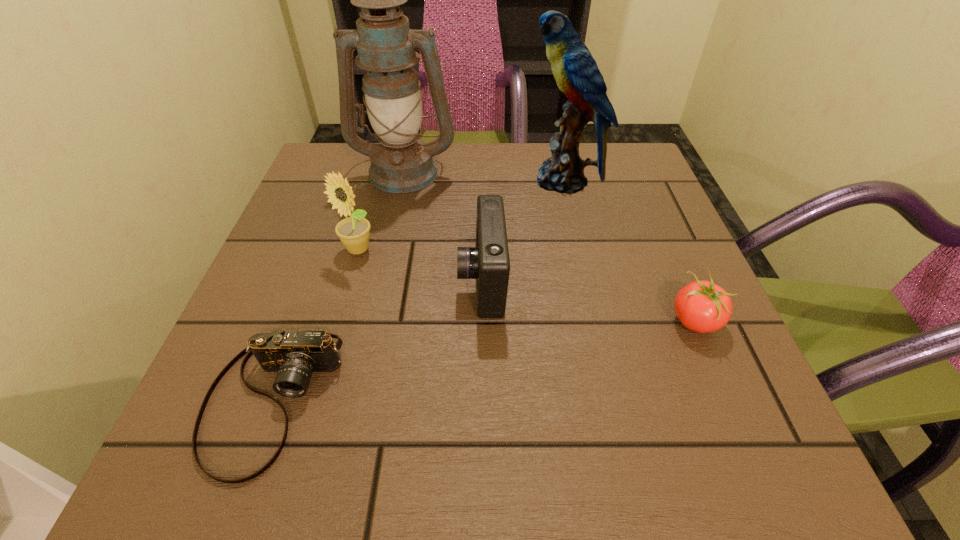
This screenshot has height=540, width=960. What are the coordinates of `oil lamp` in the screenshot? It's located at (401, 163).

Where is `parrot`? The width and height of the screenshot is (960, 540). parrot is located at coordinates (576, 72).

Where is `sunflower`? sunflower is located at coordinates coord(354,233).

This screenshot has height=540, width=960. In order to click on the taller camera in this screenshot , I will do `click(488, 262)`.

Find the location of a particular element. This screenshot has width=960, height=540. the third object from right to left is located at coordinates (488, 262).

Find the location of `tomato`. tomato is located at coordinates (701, 306).

The width and height of the screenshot is (960, 540). In order to click on the rightmost object in this screenshot , I will do `click(701, 306)`.

Image resolution: width=960 pixels, height=540 pixels. Find the location of `the shortest object`. the shortest object is located at coordinates [x=294, y=355].

What are the coordinates of `the shorter camera` in the screenshot? It's located at (294, 355).

This screenshot has height=540, width=960. I want to click on vacant region located on the right of the oil lamp, so click(x=583, y=171).